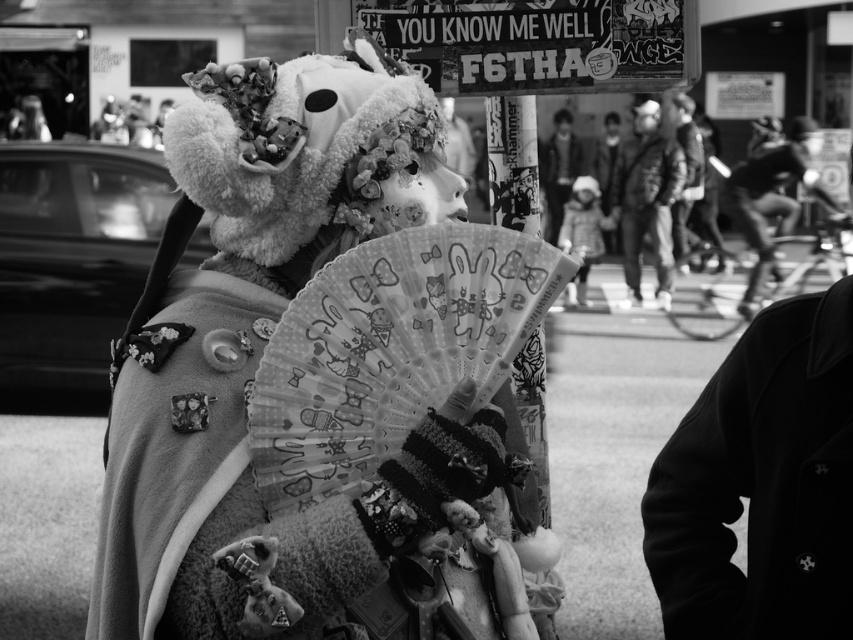
Question: Which point is closer to the camera?

Choices:
 (A) (532, 624)
 (B) (635, 273)

Answer: (A)

Question: Among these points, which one is nearest to the camera?

Choices:
 (A) (172, 488)
 (B) (659, 164)

Answer: (A)

Question: Observing the image, what is the correct spatial positioning of fluffy white teddy bear at center in reference to dark gray jacket at center?

Choices:
 (A) below
 (B) above

Answer: (A)

Question: Considering the relative positions of fluffy white teddy bear at center and dark gray jacket at center in the image provided, where is fluffy white teddy bear at center located with respect to dark gray jacket at center?

Choices:
 (A) right
 (B) left

Answer: (B)

Question: Is fluffy white teddy bear at center smaller than dark gray jacket at center?

Choices:
 (A) no
 (B) yes

Answer: (B)

Question: Among these points, which one is farthest from the camera?

Choices:
 (A) (630, 305)
 (B) (260, 285)

Answer: (A)